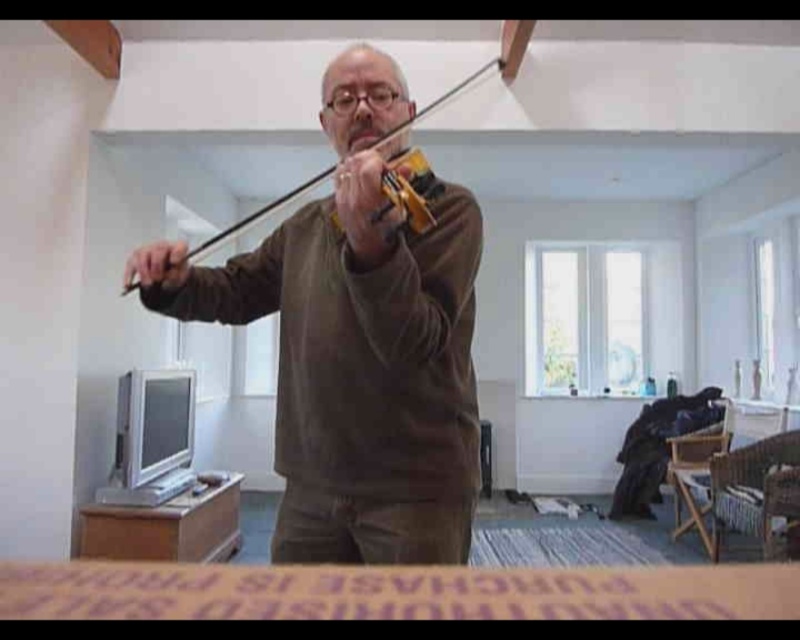
Who is positioned more to the left, brown velvet violin at center or wooden violin at center?

From the viewer's perspective, wooden violin at center appears more on the left side.

Who is shorter, brown velvet violin at center or wooden violin at center?

wooden violin at center is shorter.

Locate an element on the screen. brown velvet violin at center is located at coordinates (356, 344).